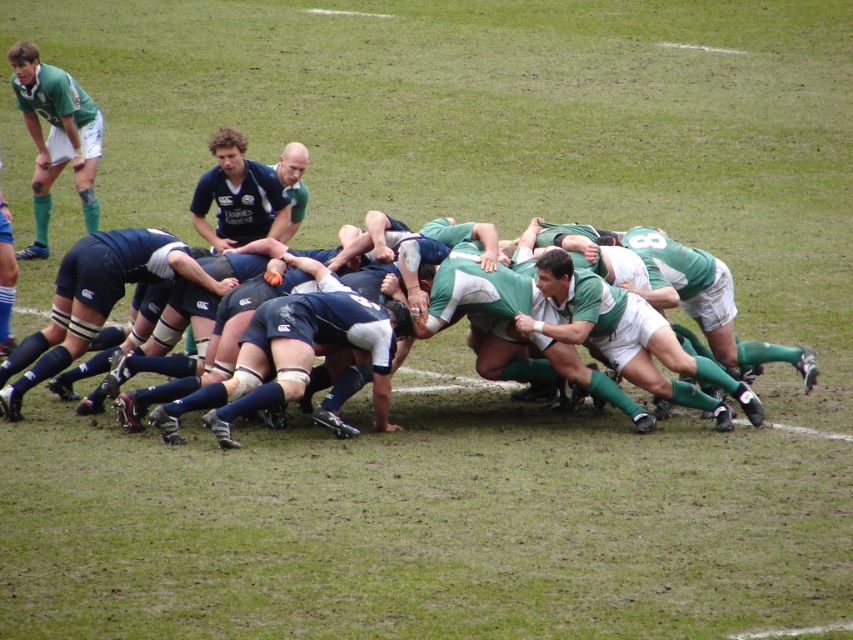
Looking at this image, you are a referee observing a rugby scrum. You notice two players wearing dark blue jersey at center and green jersey at center. Which player is positioned to the left side of the other?

The dark blue jersey at center is to the left of green jersey at center, so the player in dark blue jersey at center is positioned to the left of the player in green jersey at center.

You are a referee observing the scrum in the rugby match. You need to ensure that the teams are positioned correctly according to the rules, which state that opposing players must be at least 5 feet apart. Based on the image, are the dark blue jersey at center and green jersey at center meeting this requirement?

The dark blue jersey at center and green jersey at center are 5.61 feet apart, which exceeds the minimum required distance of 5 feet. Therefore, they are positioned correctly according to the rules.

You are a referee observing a rugby scrum. You notice the dark blue jersey at center and the matte green shorts at upper left. Which object takes up more space in the image?

The dark blue jersey at center is bigger than the matte green shorts at upper left, so it takes up more space in the image.